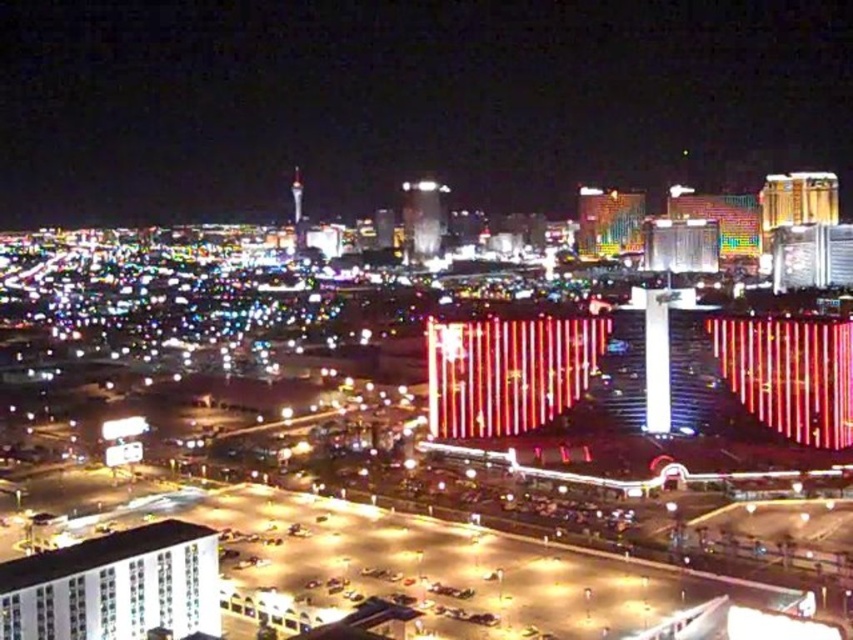
In the scene shown: You are standing in the parking lot and want to locate the glittering neon lights at center. Which direction should you look relative to the white glossy building at lower left?

You should look to the right of the white glossy building at lower left to find the glittering neon lights at center.

You are a photographer standing in the parking lot and want to capture a photo of the white glossy building at lower left without the glittering neon lights at center blocking the view. Is this possible?

The white glossy building at lower left is behind the glittering neon lights at center, so it will be blocked by them. You cannot capture the white glossy building at lower left without the glittering neon lights at center in the photo.

You are a photographer standing at the camera position in the scene. You want to capture the glittering neon lights at center in your photo. Considering the distance between you and the lights, can you use a standard zoom lens with a maximum focus range of 400 meters? Please explain.

The distance between the glittering neon lights at center and the camera is 446.14 meters. Since the maximum focus range of the standard zoom lens is 400 meters, it cannot reach the required distance. Therefore, the lens will not be able to focus on the glittering neon lights at center clearly.